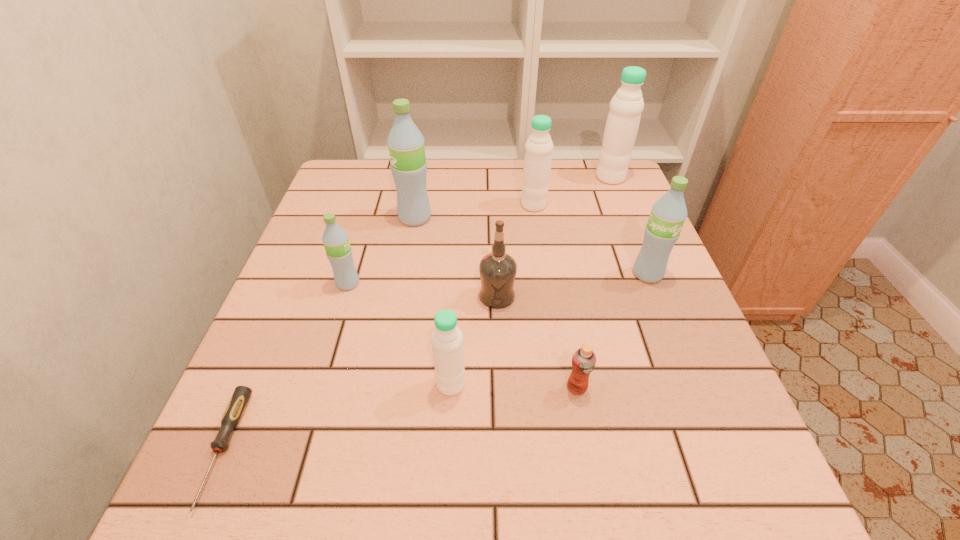
Image resolution: width=960 pixels, height=540 pixels. In order to click on free spot between the eighth object from right to left and the seventh object from right to left in this screenshot , I will do pos(381,251).

Locate an element on the screen. blank region between the fourth object from left to right and the eighth tallest object is located at coordinates (514, 386).

In order to click on object that is the sixth closest to the orange juice in this screenshot , I will do `click(405, 142)`.

At what (x,y) coordinates should I click in order to perform the action: click on object that stands as the fifth closest to the screwdriver. Please return your answer as a coordinate pair (x, y). The width and height of the screenshot is (960, 540). Looking at the image, I should click on pyautogui.click(x=584, y=359).

Select which water bottle appears as the closest to the leftmost object. Please provide its 2D coordinates. Your answer should be formatted as a tuple, i.e. [(x, y)], where the tuple contains the x and y coordinates of a point satisfying the conditions above.

[(335, 239)]

Image resolution: width=960 pixels, height=540 pixels. In order to click on the fourth closest water bottle to the second smallest green water bottle in this screenshot , I will do `click(405, 142)`.

The image size is (960, 540). I want to click on white water bottle that stands as the second closest to the leftmost green water bottle, so click(538, 149).

Identify the location of white water bottle that can be found as the closest to the rightmost green water bottle. This screenshot has width=960, height=540. (538, 149).

Locate an element on the screen. The height and width of the screenshot is (540, 960). green water bottle that is the closest to the third object from left to right is located at coordinates (335, 239).

Find the location of a particular element. The image size is (960, 540). green water bottle object that ranks as the second closest to the second biggest white water bottle is located at coordinates (668, 214).